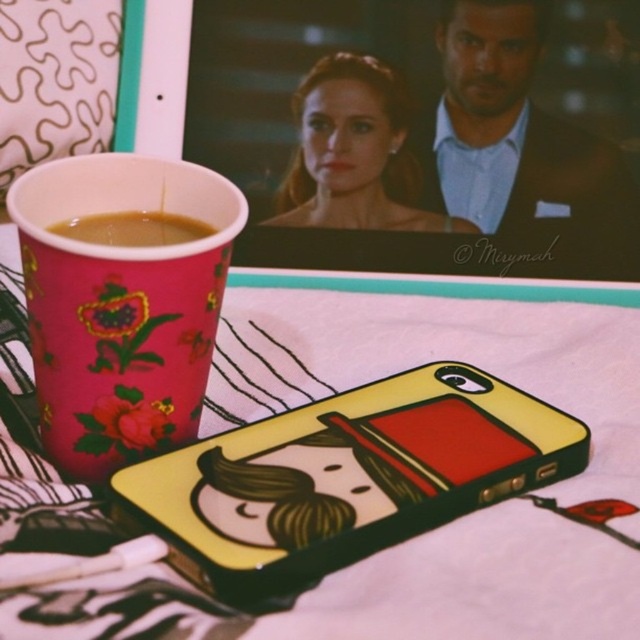
Question: Does yellow matte phone case at center appear over matte black suit at upper right?

Choices:
 (A) yes
 (B) no

Answer: (B)

Question: Which point is closer to the camera?

Choices:
 (A) 205,170
 (B) 161,506

Answer: (B)

Question: Which point is closer to the camera?

Choices:
 (A) (390, 125)
 (B) (97, 227)
 (C) (307, 436)
 (D) (204, 362)

Answer: (D)

Question: Can you confirm if pink paper cup at left is wider than brown matte cup at left?

Choices:
 (A) yes
 (B) no

Answer: (A)

Question: Among these objects, which one is farthest from the camera?

Choices:
 (A) matte black hair at center
 (B) pink paper cup at left
 (C) brown matte cup at left
 (D) yellow matte phone case at center

Answer: (A)

Question: Can you confirm if matte black suit at upper right is positioned to the left of matte black hair at center?

Choices:
 (A) no
 (B) yes

Answer: (A)